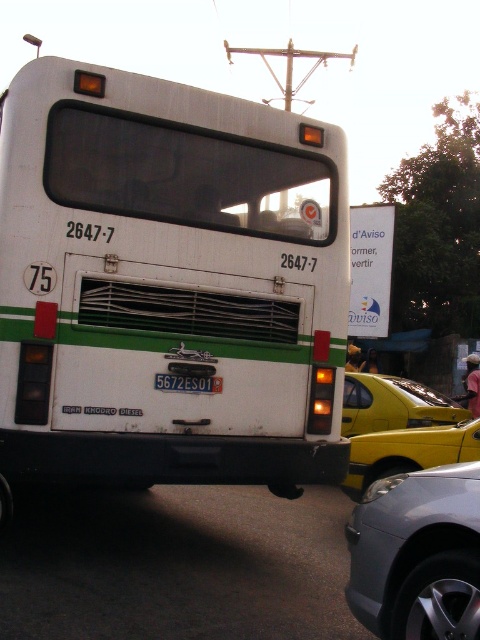
Question: In this image, where is white matte bus at center located relative to white plastic license plate at center?

Choices:
 (A) above
 (B) below

Answer: (A)

Question: Considering the real-world distances, which object is closest to the white matte bus at center?

Choices:
 (A) satin silver car at lower right
 (B) yellow matte taxi at center
 (C) white plastic license plate at center

Answer: (C)

Question: Is satin silver car at lower right further to camera compared to white plastic license plate at center?

Choices:
 (A) yes
 (B) no

Answer: (B)

Question: Is satin silver car at lower right positioned in front of yellow matte taxi at center?

Choices:
 (A) yes
 (B) no

Answer: (A)

Question: Which of the following is the closest to the observer?

Choices:
 (A) white plastic license plate at center
 (B) white matte bus at center
 (C) yellow matte taxi at center
 (D) satin silver car at lower right

Answer: (D)

Question: Estimate the real-world distances between objects in this image. Which object is farther from the white matte bus at center?

Choices:
 (A) white plastic license plate at center
 (B) yellow matte taxi at center
 (C) satin silver car at lower right

Answer: (B)